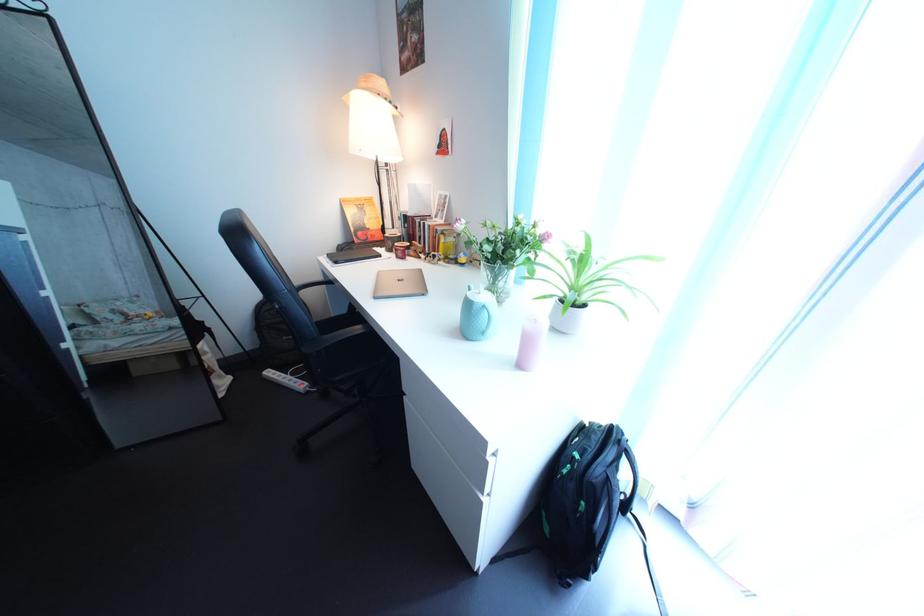
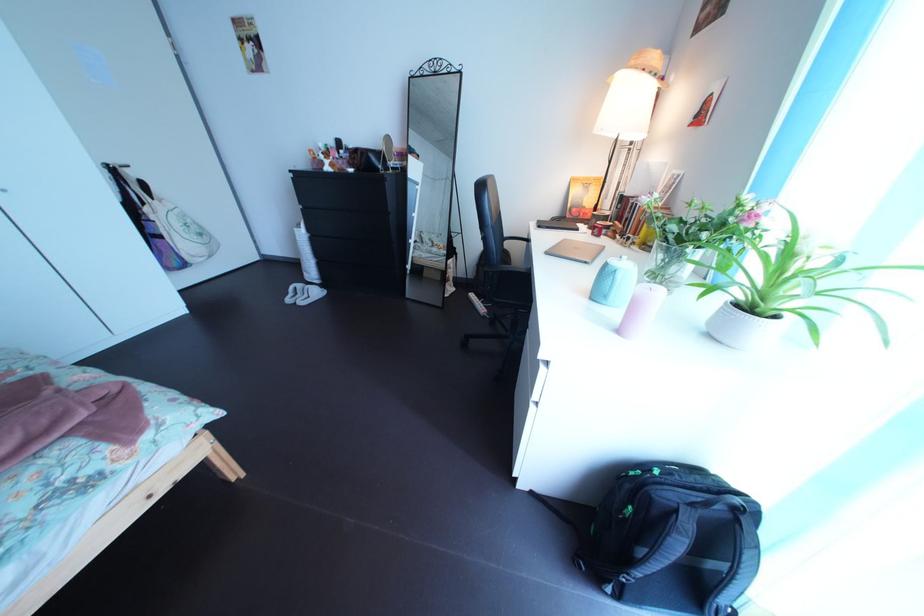
The point at (x=497, y=342) is marked in the first image. Where is the corresponding point in the second image?

(621, 305)